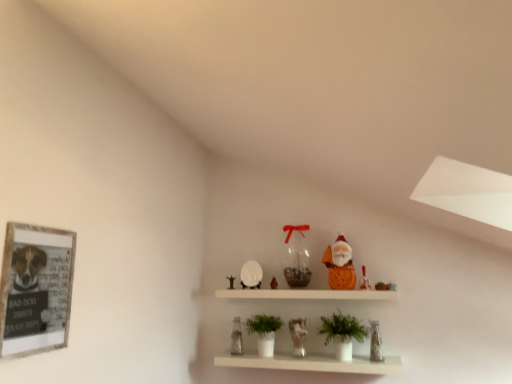
Identify the location of vacant area situated below translucent glass vase at center, placed as the fifth toy when sorted from right to left (from a real-world perspective). (296, 287).